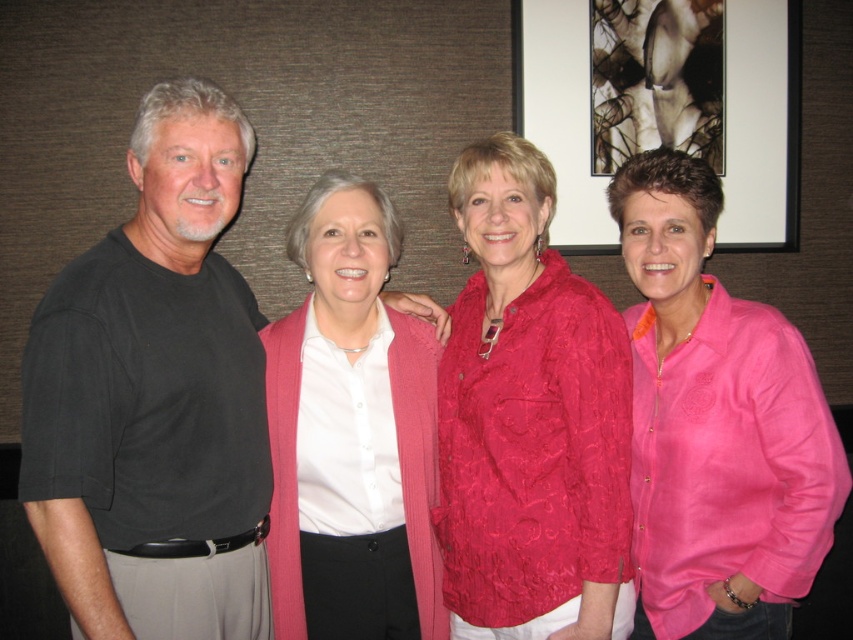
Question: Which object is positioned closest to the pink satin blouse at right?

Choices:
 (A) black cotton t-shirt at left
 (B) pink knitted cardigan at center
 (C) matte pink blouse at center
 (D) black glossy picture frame at upper center

Answer: (C)

Question: Which point is closer to the camera taking this photo?

Choices:
 (A) (146, 177)
 (B) (666, 369)
 (C) (595, 596)
 (D) (613, 90)

Answer: (C)

Question: Does matte pink blouse at center lie in front of pink satin blouse at right?

Choices:
 (A) no
 (B) yes

Answer: (B)

Question: From the image, what is the correct spatial relationship of pink satin blouse at right in relation to black glossy picture frame at upper center?

Choices:
 (A) below
 (B) above

Answer: (A)

Question: Is matte pink blouse at center smaller than black glossy picture frame at upper center?

Choices:
 (A) no
 (B) yes

Answer: (A)

Question: Estimate the real-world distances between objects in this image. Which object is farther from the pink satin blouse at right?

Choices:
 (A) black cotton t-shirt at left
 (B) pink knitted cardigan at center
 (C) matte pink blouse at center

Answer: (A)